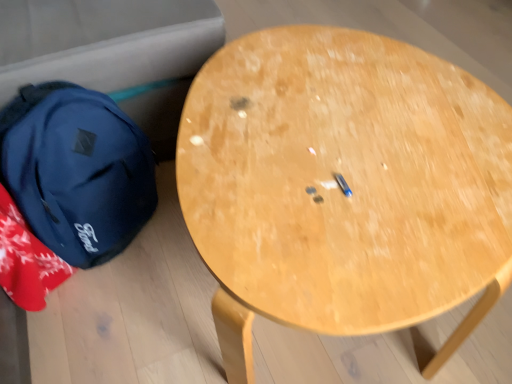
What is the approximate height of matte blue backpack at left?

It is 45.29 centimeters.

Where is `matte blue backpack at left`? The height and width of the screenshot is (384, 512). matte blue backpack at left is located at coordinates (76, 170).

Image resolution: width=512 pixels, height=384 pixels. Describe the element at coordinates (76, 170) in the screenshot. I see `matte blue backpack at left` at that location.

Image resolution: width=512 pixels, height=384 pixels. What do you see at coordinates (347, 183) in the screenshot?
I see `light wood table at center` at bounding box center [347, 183].

At what (x,y) coordinates should I click in order to perform the action: click on light wood table at center. Please return your answer as a coordinate pair (x, y). Looking at the image, I should click on (347, 183).

You are a GUI agent. You are given a task and a screenshot of the screen. Output one action in this format:
    pyautogui.click(x=<x>, y=<y>)
    Task: Click on the matte blue backpack at left
    The width and height of the screenshot is (512, 384).
    Given the screenshot: What is the action you would take?
    pyautogui.click(x=76, y=170)

Is light wood table at center to the left or to the right of matte blue backpack at left in the image?

Based on their positions, light wood table at center is located to the right of matte blue backpack at left.

Does light wood table at center come in front of matte blue backpack at left?

Yes.

Is point (251, 258) in front of point (111, 237)?

Yes, it is.

From the image's perspective, which object appears higher, light wood table at center or matte blue backpack at left?

From the image's view, matte blue backpack at left is above.

From a real-world perspective, relative to matte blue backpack at left, is light wood table at center vertically above or below?

light wood table at center is above matte blue backpack at left.

Does light wood table at center have a lesser width compared to matte blue backpack at left?

No.

Does light wood table at center have a greater height compared to matte blue backpack at left?

Yes.

Which of these two, light wood table at center or matte blue backpack at left, is bigger?

Bigger between the two is light wood table at center.

Would you say light wood table at center is inside or outside matte blue backpack at left?

light wood table at center lies outside matte blue backpack at left.

Would you say light wood table at center is a long distance from matte blue backpack at left?

That's not correct — light wood table at center is a little close to matte blue backpack at left.

Is light wood table at center positioned with its back to matte blue backpack at left?

Yes, light wood table at center's orientation is away from matte blue backpack at left.

What's the angular difference between light wood table at center and matte blue backpack at left's facing directions?

There is a 66.8-degree angle between the facing directions of light wood table at center and matte blue backpack at left.

This screenshot has width=512, height=384. I want to click on table that appears in front of the matte blue backpack at left, so click(x=347, y=183).

Which object is positioned more to the right, matte blue backpack at left or light wood table at center?

Positioned to the right is light wood table at center.

In the image, is matte blue backpack at left positioned in front of or behind light wood table at center?

In the image, matte blue backpack at left appears behind light wood table at center.

Does point (96, 108) lie behind point (401, 302)?

Yes, it is behind point (401, 302).

From the image's perspective, is matte blue backpack at left located beneath light wood table at center?

No, from the image's perspective, matte blue backpack at left is not beneath light wood table at center.

From a real-world perspective, who is located lower, matte blue backpack at left or light wood table at center?

matte blue backpack at left, from a real-world perspective.

Looking at their sizes, would you say matte blue backpack at left is wider or thinner than light wood table at center?

matte blue backpack at left is thinner than light wood table at center.

Who is taller, matte blue backpack at left or light wood table at center?

Standing taller between the two is light wood table at center.

Considering the relative sizes of matte blue backpack at left and light wood table at center in the image provided, is matte blue backpack at left smaller than light wood table at center?

Yes.

Is matte blue backpack at left inside or outside of light wood table at center?

The correct answer is: outside.

Are matte blue backpack at left and light wood table at center making contact?

No, matte blue backpack at left is not beside light wood table at center.

Could you tell me if matte blue backpack at left is turned towards light wood table at center?

Yes, matte blue backpack at left is oriented towards light wood table at center.

Can you tell me how much matte blue backpack at left and light wood table at center differ in facing direction?

The facing directions of matte blue backpack at left and light wood table at center are 66.8 degrees apart.

Locate an element on the screen. The height and width of the screenshot is (384, 512). backpack on the left side of light wood table at center is located at coordinates (76, 170).

Identify the location of backpack that is under the light wood table at center (from a real-world perspective). This screenshot has width=512, height=384. (76, 170).

Image resolution: width=512 pixels, height=384 pixels. In order to click on table located below the matte blue backpack at left (from the image's perspective) in this screenshot , I will do `click(347, 183)`.